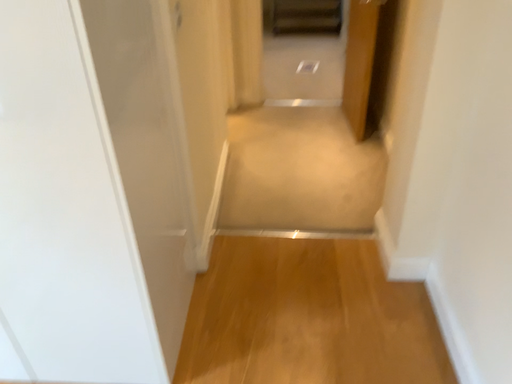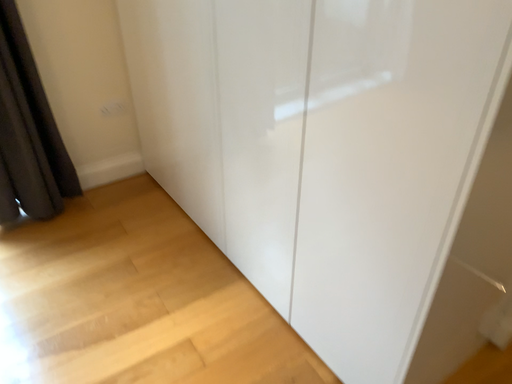
Question: How did the camera likely rotate when shooting the video?

Choices:
 (A) rotated right
 (B) rotated left

Answer: (B)